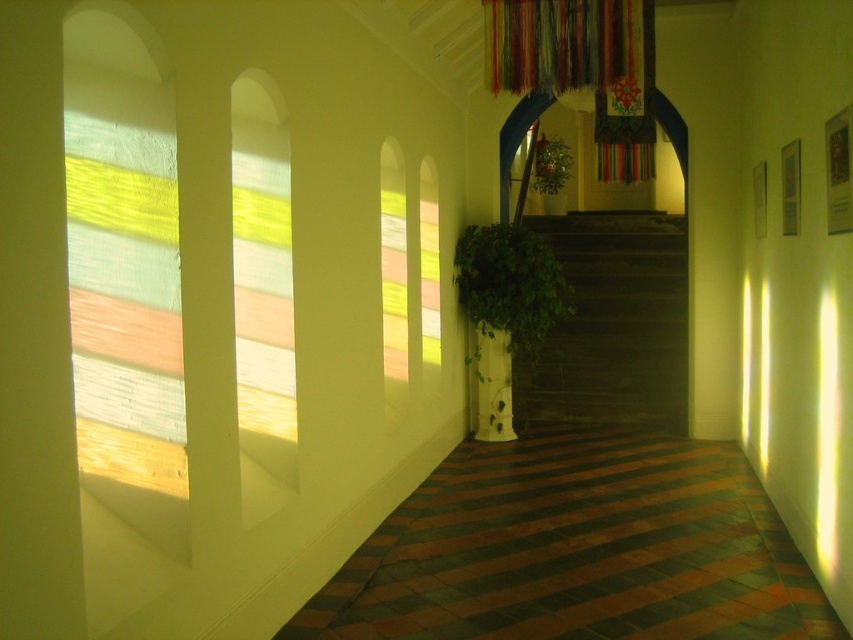
Can you confirm if dark wood stairs at center is positioned above green leafy plant at center?

No, dark wood stairs at center is not above green leafy plant at center.

Locate an element on the screen. The width and height of the screenshot is (853, 640). dark wood stairs at center is located at coordinates (612, 323).

At what (x,y) coordinates should I click in order to perform the action: click on dark wood stairs at center. Please return your answer as a coordinate pair (x, y). Image resolution: width=853 pixels, height=640 pixels. Looking at the image, I should click on (612, 323).

This screenshot has width=853, height=640. Describe the element at coordinates (612, 323) in the screenshot. I see `dark wood stairs at center` at that location.

Who is lower down, dark wood stairs at center or green glossy plant at center?

Positioned lower is green glossy plant at center.

Locate an element on the screen. This screenshot has height=640, width=853. dark wood stairs at center is located at coordinates (612, 323).

Who is positioned more to the right, dark wood stairs at center or multicolored fabric curtain at upper center?

Positioned to the right is dark wood stairs at center.

Does point (648, 381) lie behind point (590, 48)?

That is True.

The width and height of the screenshot is (853, 640). I want to click on dark wood stairs at center, so click(x=612, y=323).